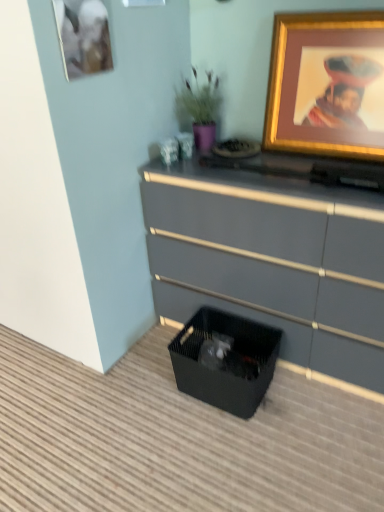
The image size is (384, 512). What do you see at coordinates (225, 360) in the screenshot?
I see `black mesh storage box at lower center` at bounding box center [225, 360].

You are a GUI agent. You are given a task and a screenshot of the screen. Output one action in this format:
    pyautogui.click(x=<x>, y=<y>)
    Task: Click on the gold-framed picture at upper right, the first picture frame viewed from the right
    
    Given the screenshot: What is the action you would take?
    pyautogui.click(x=327, y=85)

What do you see at coordinates (83, 36) in the screenshot?
I see `matte gold picture frame at upper left, the first picture frame from the left` at bounding box center [83, 36].

Where is `black mesh storage box at lower center`? The width and height of the screenshot is (384, 512). black mesh storage box at lower center is located at coordinates (225, 360).

Is gold-framed picture at upper right, the first picture frame viewed from the right, touching black mesh storage box at lower center?

No, gold-framed picture at upper right, the first picture frame viewed from the right, is not with black mesh storage box at lower center.

Considering the sizes of objects gold-framed picture at upper right, the 2th picture frame from the left, and black mesh storage box at lower center in the image provided, who is smaller, gold-framed picture at upper right, the 2th picture frame from the left, or black mesh storage box at lower center?

black mesh storage box at lower center is smaller.

What's the angular difference between gold-framed picture at upper right, the first picture frame viewed from the right, and black mesh storage box at lower center's facing directions?

1.62 degrees separate the facing orientations of gold-framed picture at upper right, the first picture frame viewed from the right, and black mesh storage box at lower center.

Does matte gray dresser at center appear on the right side of black mesh storage box at lower center?

Yes, matte gray dresser at center is to the right of black mesh storage box at lower center.

Is matte gray dresser at center taller than black mesh storage box at lower center?

Correct, matte gray dresser at center is much taller as black mesh storage box at lower center.

Is matte gray dresser at center far from black mesh storage box at lower center?

No.

Can you tell me how much matte gray dresser at center and black mesh storage box at lower center differ in facing direction?

matte gray dresser at center and black mesh storage box at lower center are facing 1.73 degrees away from each other.

Considering the relative sizes of purple matte vase at upper center and gold-framed picture at upper right, the 2th picture frame from the left, in the image provided, is purple matte vase at upper center smaller than gold-framed picture at upper right, the 2th picture frame from the left,?

Yes, purple matte vase at upper center is smaller than gold-framed picture at upper right, the 2th picture frame from the left.

Is purple matte vase at upper center turned away from gold-framed picture at upper right, the 2th picture frame from the left?

No, purple matte vase at upper center is not facing away from gold-framed picture at upper right, the 2th picture frame from the left.

Consider the image. Considering the sizes of purple matte vase at upper center and gold-framed picture at upper right, the first picture frame viewed from the right, in the image, is purple matte vase at upper center wider or thinner than gold-framed picture at upper right, the first picture frame viewed from the right,?

Considering their sizes, purple matte vase at upper center looks broader than gold-framed picture at upper right, the first picture frame viewed from the right.

Is gold-framed picture at upper right, the first picture frame viewed from the right, wider than purple matte vase at upper center?

No.

Which is closer, (369, 105) or (208, 128)?

Point (369, 105) is positioned closer to the camera compared to point (208, 128).

Which of these two, gold-framed picture at upper right, the 2th picture frame from the left, or purple matte vase at upper center, stands taller?

With more height is gold-framed picture at upper right, the 2th picture frame from the left.

Is matte gold picture frame at upper left, the first picture frame from the left, positioned beyond the bounds of matte gray dresser at center?

Yes, matte gold picture frame at upper left, the first picture frame from the left, is not within matte gray dresser at center.

Consider the image. Is matte gold picture frame at upper left, the first picture frame from the left, far away from matte gray dresser at center?

matte gold picture frame at upper left, the first picture frame from the left, is actually quite close to matte gray dresser at center.

Is matte gold picture frame at upper left, the first picture frame from the left, facing away from matte gray dresser at center?

No, matte gold picture frame at upper left, the first picture frame from the left, is not facing away from matte gray dresser at center.

Based on their sizes in the image, would you say matte gold picture frame at upper left, the first picture frame from the left, is bigger or smaller than matte gray dresser at center?

Considering their sizes, matte gold picture frame at upper left, the first picture frame from the left, takes up less space than matte gray dresser at center.

Is black mesh storage box at lower center positioned in front of purple matte vase at upper center?

Yes, it is.

Would you say black mesh storage box at lower center is a long distance from purple matte vase at upper center?

No, black mesh storage box at lower center is in close proximity to purple matte vase at upper center.

Does black mesh storage box at lower center have a greater width compared to purple matte vase at upper center?

Yes.

Could you tell me if black mesh storage box at lower center is turned towards purple matte vase at upper center?

No, black mesh storage box at lower center is not oriented towards purple matte vase at upper center.

Based on the photo, does gold-framed picture at upper right, the first picture frame viewed from the right, appear on the right side of matte gold picture frame at upper left, placed as the 2th picture frame when sorted from right to left?

Yes.

Is point (377, 12) positioned in front of point (70, 57)?

No, (377, 12) is further to viewer.

From the image's perspective, is gold-framed picture at upper right, the 2th picture frame from the left, located above matte gold picture frame at upper left, the first picture frame from the left?

No, from the image's perspective, gold-framed picture at upper right, the 2th picture frame from the left, is not on top of matte gold picture frame at upper left, the first picture frame from the left.

Based on the photo, is gold-framed picture at upper right, the 2th picture frame from the left, turned away from matte gold picture frame at upper left, the first picture frame from the left?

No, gold-framed picture at upper right, the 2th picture frame from the left, is not facing away from matte gold picture frame at upper left, the first picture frame from the left.

This screenshot has height=512, width=384. What are the coordinates of `picture frame that appears on the right of black mesh storage box at lower center` in the screenshot? It's located at (327, 85).

You are a GUI agent. You are given a task and a screenshot of the screen. Output one action in this format:
    pyautogui.click(x=<x>, y=<y>)
    Task: Click on the storage box that is below the matte gray dresser at center (from the image's perspective)
    Image resolution: width=384 pixels, height=512 pixels.
    Given the screenshot: What is the action you would take?
    pyautogui.click(x=225, y=360)

Based on their spatial positions, is purple matte vase at upper center or matte gray dresser at center closer to matte gold picture frame at upper left, placed as the 2th picture frame when sorted from right to left?

Among the two, purple matte vase at upper center is located nearer to matte gold picture frame at upper left, placed as the 2th picture frame when sorted from right to left.

When comparing their distances from purple matte vase at upper center, does matte gray dresser at center or black mesh storage box at lower center seem further?

The object further to purple matte vase at upper center is black mesh storage box at lower center.

When comparing their distances from gold-framed picture at upper right, the first picture frame viewed from the right, does matte gray dresser at center or matte gold picture frame at upper left, placed as the 2th picture frame when sorted from right to left, seem further?

matte gold picture frame at upper left, placed as the 2th picture frame when sorted from right to left.

Looking at the image, which one is located further to black mesh storage box at lower center, matte gold picture frame at upper left, the first picture frame from the left, or purple matte vase at upper center?

matte gold picture frame at upper left, the first picture frame from the left, is positioned further to the anchor black mesh storage box at lower center.

Based on their spatial positions, is purple matte vase at upper center or matte gold picture frame at upper left, placed as the 2th picture frame when sorted from right to left, further from black mesh storage box at lower center?

matte gold picture frame at upper left, placed as the 2th picture frame when sorted from right to left, is further to black mesh storage box at lower center.

Estimate the real-world distances between objects in this image. Which object is further from purple matte vase at upper center, matte gold picture frame at upper left, placed as the 2th picture frame when sorted from right to left, or matte gray dresser at center?

matte gold picture frame at upper left, placed as the 2th picture frame when sorted from right to left.

Which object lies further to the anchor point black mesh storage box at lower center, purple matte vase at upper center or matte gray dresser at center?

purple matte vase at upper center lies further to black mesh storage box at lower center than the other object.

From the image, which object appears to be farther from black mesh storage box at lower center, matte gold picture frame at upper left, placed as the 2th picture frame when sorted from right to left, or matte gray dresser at center?

matte gold picture frame at upper left, placed as the 2th picture frame when sorted from right to left, is further to black mesh storage box at lower center.

Locate an element on the screen. chest of drawers between gold-framed picture at upper right, the first picture frame viewed from the right, and black mesh storage box at lower center from top to bottom is located at coordinates (273, 261).

Locate an element on the screen. The height and width of the screenshot is (512, 384). houseplant between matte gold picture frame at upper left, the first picture frame from the left, and matte gray dresser at center vertically is located at coordinates (199, 109).

This screenshot has height=512, width=384. I want to click on picture frame between purple matte vase at upper center and black mesh storage box at lower center from top to bottom, so click(x=327, y=85).

The width and height of the screenshot is (384, 512). I want to click on chest of drawers between purple matte vase at upper center and black mesh storage box at lower center from top to bottom, so click(273, 261).